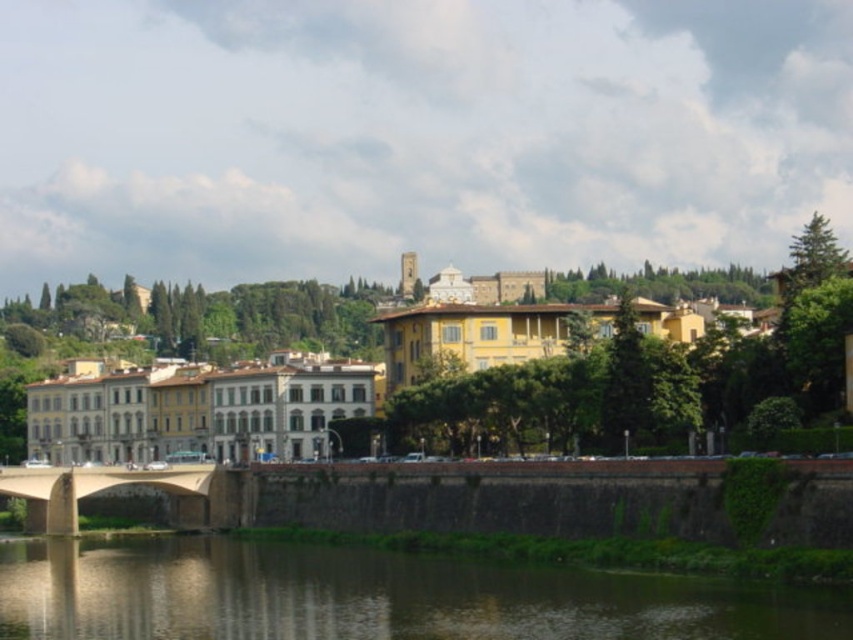
You are an architect visiting this riverside area and want to take a photo that includes both the yellow matte building at center and the brown stone bridge at lower left. Considering their heights, which one should you position closer to the bottom of your camera frame to ensure both are fully visible in the photo?

The yellow matte building at center is much taller than the brown stone bridge at lower left. To ensure both are fully visible in the photo, position the brown stone bridge at lower left closer to the bottom of the camera frame since it is shorter, allowing the taller building to fit within the frame without being cut off.

You are an architect visiting this riverside area and want to take a photo that includes both the yellow matte building at center and the brown reflective water at lower center. Which object should you position closer to the center of your camera frame to ensure both are clearly visible?

To ensure both the yellow matte building at center and the brown reflective water at lower center are clearly visible, you should position the yellow matte building at center closer to the center of your camera frame since it is larger than the brown reflective water at lower center.

You are an architect visiting this riverside area and want to compare the sizes of the yellow matte building at center and the brown stone bridge at lower left. Which one has a larger size?

The yellow matte building at center is bigger than the brown stone bridge at lower left according to the description.